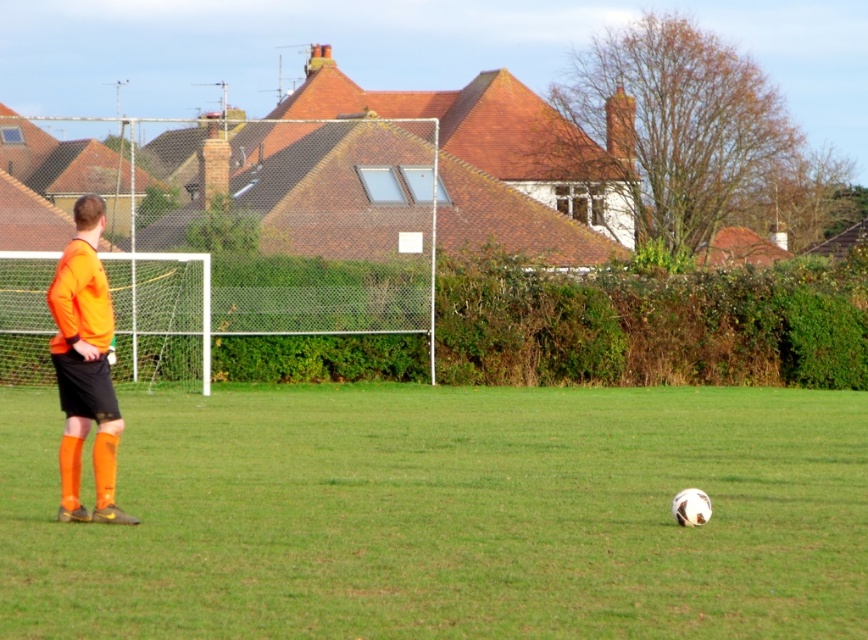
You are a soccer coach observing the field. The green grass at center and orange matte jersey at left are in your view. Which object is directly below the other?

The green grass at center is positioned under orange matte jersey at left, meaning the orange matte jersey at left is above the green grass at center.

You are a soccer coach analyzing the field layout. Which object occupies a larger area in the image, the green grass at center or the orange matte jersey at left?

The green grass at center is bigger than the orange matte jersey at left, so the green grass at center occupies a larger area in the image.